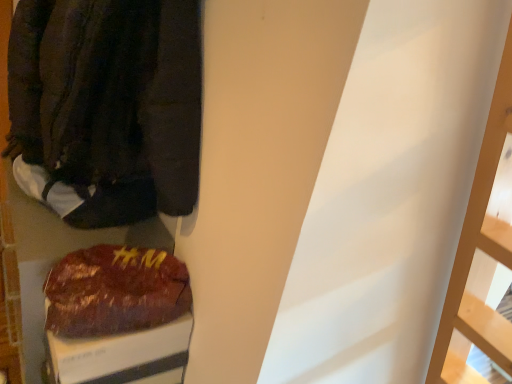
In order to click on shiny brown bag at lower left in this screenshot , I will do `click(115, 291)`.

Is dark brown fabric jacket at left to the left of shiny brown bag at lower left from the viewer's perspective?

No, dark brown fabric jacket at left is not to the left of shiny brown bag at lower left.

Are dark brown fabric jacket at left and shiny brown bag at lower left far apart?

Actually, dark brown fabric jacket at left and shiny brown bag at lower left are a little close together.

Can you confirm if dark brown fabric jacket at left is thinner than shiny brown bag at lower left?

No, dark brown fabric jacket at left is not thinner than shiny brown bag at lower left.

From the picture: Looking at their sizes, would you say shiny brown bag at lower left is wider or thinner than white fabric shoe at left?

Considering their sizes, shiny brown bag at lower left looks slimmer than white fabric shoe at left.

Does shiny brown bag at lower left have a smaller size compared to white fabric shoe at left?

Correct, shiny brown bag at lower left occupies less space than white fabric shoe at left.

The width and height of the screenshot is (512, 384). Find the location of `footwear on the left side of shiny brown bag at lower left`. footwear on the left side of shiny brown bag at lower left is located at coordinates (88, 198).

Based on the photo, which object is closer to the camera, shiny brown bag at lower left or white fabric shoe at left?

Positioned in front is shiny brown bag at lower left.

Can you confirm if white fabric shoe at left is shorter than shiny brown bag at lower left?

No.

Measure the distance between white fabric shoe at left and shiny brown bag at lower left.

They are 8.98 inches apart.

Does white fabric shoe at left have a larger size compared to shiny brown bag at lower left?

Yes, white fabric shoe at left is bigger than shiny brown bag at lower left.

Would you say white fabric shoe at left is a long distance from shiny brown bag at lower left?

They are positioned close to each other.

Between shiny brown bag at lower left and dark brown fabric jacket at left, which one has larger size?

Bigger between the two is dark brown fabric jacket at left.

Are shiny brown bag at lower left and dark brown fabric jacket at left far apart?

Actually, shiny brown bag at lower left and dark brown fabric jacket at left are a little close together.

Which point is more forward, (61, 277) or (39, 190)?

The point (61, 277) is more forward.

Between shiny brown bag at lower left and dark brown fabric jacket at left, which one has smaller width?

shiny brown bag at lower left is thinner.

Is dark brown fabric jacket at left at the back of white fabric shoe at left?

white fabric shoe at left does not have its back to dark brown fabric jacket at left.

Who is bigger, white fabric shoe at left or dark brown fabric jacket at left?

With larger size is dark brown fabric jacket at left.

Is white fabric shoe at left to the right of dark brown fabric jacket at left from the viewer's perspective?

No.

In the scene shown: Which of these two, white fabric shoe at left or dark brown fabric jacket at left, stands shorter?

With less height is white fabric shoe at left.

In terms of height, does dark brown fabric jacket at left look taller or shorter compared to white fabric shoe at left?

In the image, dark brown fabric jacket at left appears to be taller than white fabric shoe at left.

Is dark brown fabric jacket at left spatially inside white fabric shoe at left, or outside of it?

dark brown fabric jacket at left is located beyond the bounds of white fabric shoe at left.

Is dark brown fabric jacket at left further to the viewer compared to white fabric shoe at left?

No, it is not.

At what (x,y) coordinates should I click in order to perform the action: click on jacket that appears in front of the shiny brown bag at lower left. Please return your answer as a coordinate pair (x, y). Image resolution: width=512 pixels, height=384 pixels. Looking at the image, I should click on (106, 107).

Where is `footwear located above the shiny brown bag at lower left (from a real-world perspective)`? The height and width of the screenshot is (384, 512). footwear located above the shiny brown bag at lower left (from a real-world perspective) is located at coordinates (88, 198).

Considering their positions, is shiny brown bag at lower left positioned closer to dark brown fabric jacket at left than white fabric shoe at left?

The object closer to dark brown fabric jacket at left is white fabric shoe at left.

Which object lies further to the anchor point white fabric shoe at left, shiny brown bag at lower left or dark brown fabric jacket at left?

shiny brown bag at lower left is positioned further to the anchor white fabric shoe at left.

Considering their positions, is dark brown fabric jacket at left positioned further to shiny brown bag at lower left than white fabric shoe at left?

Based on the image, dark brown fabric jacket at left appears to be further to shiny brown bag at lower left.

From the image, which object appears to be nearer to white fabric shoe at left, dark brown fabric jacket at left or shiny brown bag at lower left?

Based on the image, dark brown fabric jacket at left appears to be nearer to white fabric shoe at left.

Estimate the real-world distances between objects in this image. Which object is closer to shiny brown bag at lower left, white fabric shoe at left or dark brown fabric jacket at left?

white fabric shoe at left lies closer to shiny brown bag at lower left than the other object.

Considering their positions, is white fabric shoe at left positioned further to dark brown fabric jacket at left than shiny brown bag at lower left?

shiny brown bag at lower left is further to dark brown fabric jacket at left.

You are a GUI agent. You are given a task and a screenshot of the screen. Output one action in this format:
    pyautogui.click(x=<x>, y=<y>)
    Task: Click on the footwear between dark brown fabric jacket at left and shiny brown bag at lower left in the up-down direction
    The width and height of the screenshot is (512, 384).
    Given the screenshot: What is the action you would take?
    pyautogui.click(x=88, y=198)